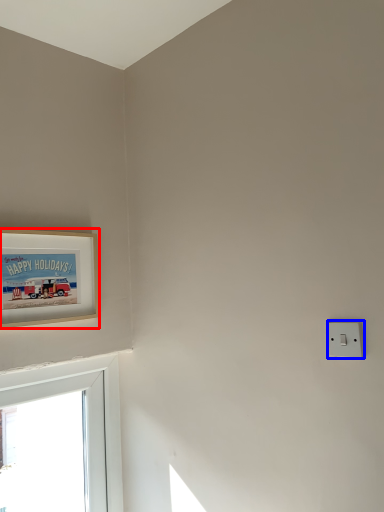
Question: Which of the following is the farthest to the observer, picture frame (highlighted by a red box) or light switch (highlighted by a blue box)?

Choices:
 (A) picture frame
 (B) light switch

Answer: (A)